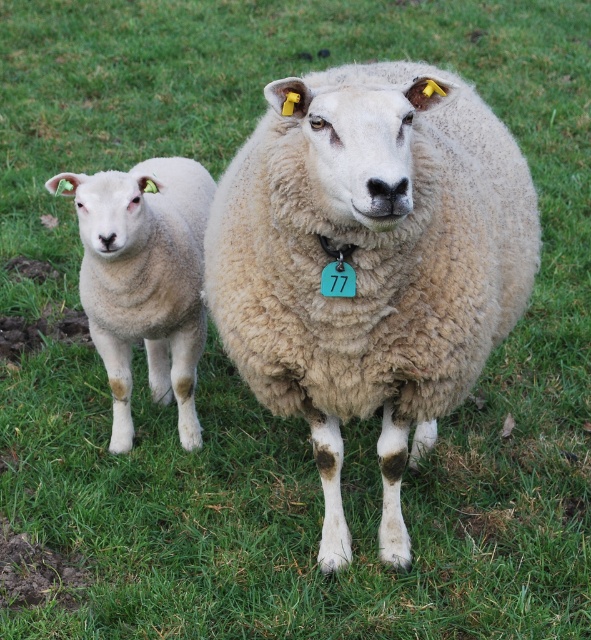
Between fuzzy beige sheep at center and white woolen lamb at left, which one appears on the left side from the viewer's perspective?

white woolen lamb at left

Who is more forward, (381,115) or (174,337)?

Positioned in front is point (381,115).

I want to click on fuzzy beige sheep at center, so click(x=371, y=262).